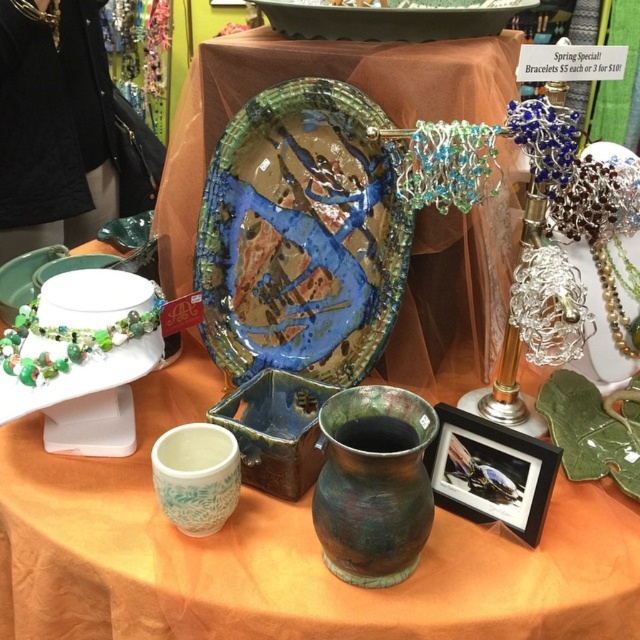
Question: Is green glazed platter at upper center below green matte plate at center?

Choices:
 (A) no
 (B) yes

Answer: (A)

Question: Which object is the closest to the green matte vase at center?

Choices:
 (A) glazed ceramic platter at center
 (B) green glazed mug at center
 (C) green matte plate at center

Answer: (B)

Question: Which of the following is the farthest from the observer?

Choices:
 (A) (381, 540)
 (B) (260, 189)
 (C) (67, 256)
 (D) (260, 1)

Answer: (C)

Question: Does rustic ceramic vase at center have a larger size compared to green matte vase at center?

Choices:
 (A) yes
 (B) no

Answer: (A)

Question: Based on their relative distances, which object is nearer to the green glazed mug at center?

Choices:
 (A) rustic ceramic vase at center
 (B) green glazed platter at upper center

Answer: (A)

Question: Is rustic ceramic vase at center wider than glazed ceramic platter at center?

Choices:
 (A) yes
 (B) no

Answer: (A)